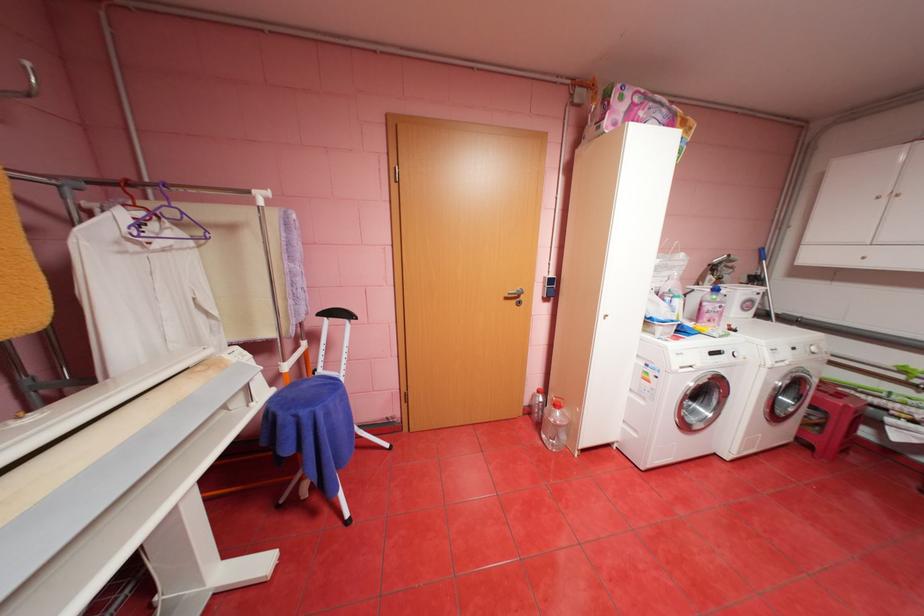
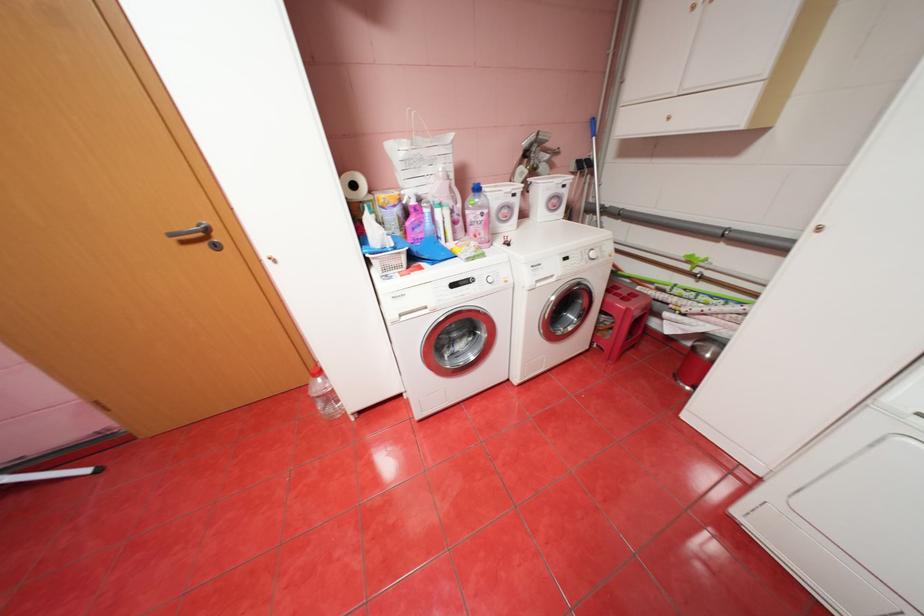
In the second image, find the point that corresponds to the point at 523,301 in the first image.

(213, 245)